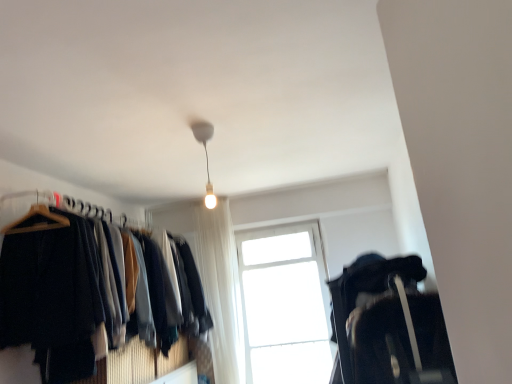
Question: In the image, is white sheer curtain at center positioned in front of or behind matte black hangers at left, the 2th closet from the right?

Choices:
 (A) front
 (B) behind

Answer: (B)

Question: From the image's perspective, is white sheer curtain at center located above or below matte black hangers at left, the 2th closet from the right?

Choices:
 (A) below
 (B) above

Answer: (A)

Question: Which is nearer to the black fabric suitcase at lower right, placed as the 1th closet when sorted from right to left?

Choices:
 (A) white sheer curtain at center
 (B) transparent glass window at center
 (C) matte black hangers at left, the 2th closet from the right
 (D) matte white bulb at upper center

Answer: (D)

Question: Estimate the real-world distances between objects in this image. Which object is farther from the transparent glass window at center?

Choices:
 (A) matte black hangers at left, the 1th closet when ordered from left to right
 (B) white sheer curtain at center
 (C) black fabric suitcase at lower right, placed as the 1th closet when sorted from right to left
 (D) matte white bulb at upper center

Answer: (D)